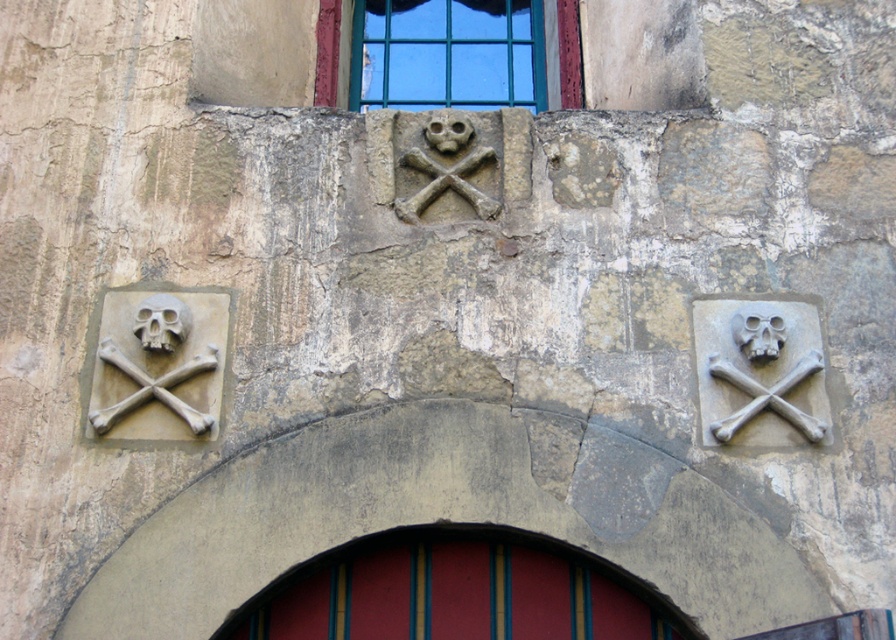
Question: Is stone skull and crossbones at center above green glass window at upper center?

Choices:
 (A) no
 (B) yes

Answer: (A)

Question: Which of these objects is positioned closest to the matte stone skull at right?

Choices:
 (A) green glass window at upper center
 (B) stone skull and crossbones at center
 (C) matte stone skull at center
 (D) gray stone skull and crossbones at upper right

Answer: (D)

Question: Which object appears closest to the camera in this image?

Choices:
 (A) gray stone skull at left
 (B) stone skull and crossbones at center

Answer: (A)

Question: Which object is the closest to the gray stone skull and crossbones at left?

Choices:
 (A) matte stone skull at right
 (B) smooth red wood door at center
 (C) matte stone skull at center
 (D) stone skull and crossbones at center

Answer: (B)

Question: Does stone skull and crossbones at center have a greater width compared to matte stone skull at center?

Choices:
 (A) yes
 (B) no

Answer: (A)

Question: Can you confirm if gray stone skull and crossbones at upper right is thinner than stone skull and crossbones at center?

Choices:
 (A) no
 (B) yes

Answer: (A)